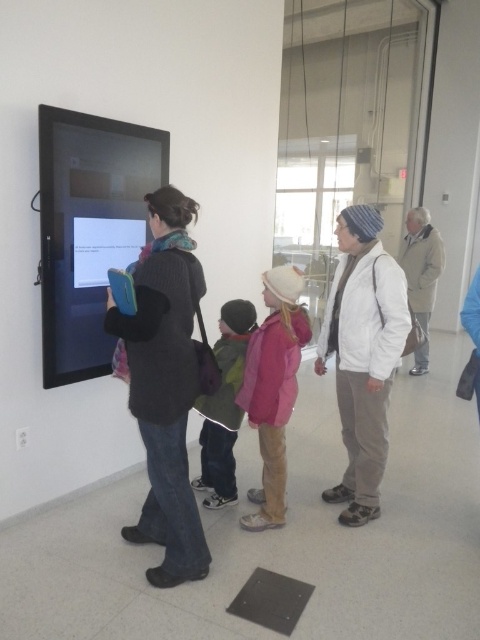
Question: Does pink fleece jacket at center lie behind gray wool coat at right?

Choices:
 (A) no
 (B) yes

Answer: (A)

Question: Which object is farther from the camera taking this photo?

Choices:
 (A) dark gray sweater at center
 (B) gray wool coat at right
 (C) white matte jacket at center

Answer: (B)

Question: Considering the real-world distances, which object is closest to the white matte jacket at center?

Choices:
 (A) gray wool coat at right
 (B) pink fleece jacket at center
 (C) dark gray sweater at center
 (D) green fuzzy jacket at center

Answer: (B)

Question: In this image, where is dark gray sweater at center located relative to white matte jacket at center?

Choices:
 (A) right
 (B) left

Answer: (B)

Question: From the image, what is the correct spatial relationship of dark gray sweater at center in relation to pink fleece jacket at center?

Choices:
 (A) below
 (B) above

Answer: (B)

Question: Estimate the real-world distances between objects in this image. Which object is closer to the green fuzzy jacket at center?

Choices:
 (A) dark gray sweater at center
 (B) gray wool coat at right

Answer: (A)